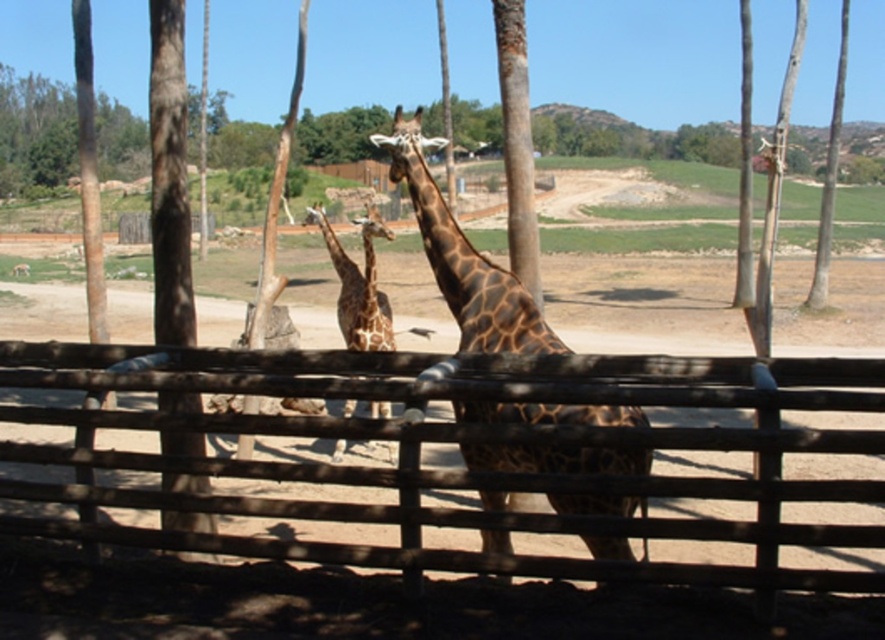
You are a zookeeper standing in front of the brown wooden fence at center. You need to reach a giraffe treat bag hanging on a hook that is 2 meters away from you. Can you reach the treat bag without moving closer to the fence?

The brown wooden fence at center is 3.56 meters from viewer. The hook is 2 meters away from you, so the hook is 1.56 meters behind the fence. Since the hook is behind the fence, you cannot reach it without moving closer.

You are a zookeeper trying to determine if the brown wooden fence at center can fit a new sign that is as wide as the brown spotted giraffe at center. Based on the scene, can the sign be placed on the fence?

The brown wooden fence at center has a width larger than the brown spotted giraffe at center, so the sign can be placed on the fence since it can accommodate the sign of the same width as the giraffe.

You are a zookeeper who needs to ensure the safety of the visitors. The brown wooden fence at center and the brown spotted giraffe at center are both in the enclosure. Can you confirm if the fence is tall enough to prevent the giraffe from reaching over it?

The brown wooden fence at center is taller than the brown spotted giraffe at center, so the fence is tall enough to prevent the giraffe from reaching over it.